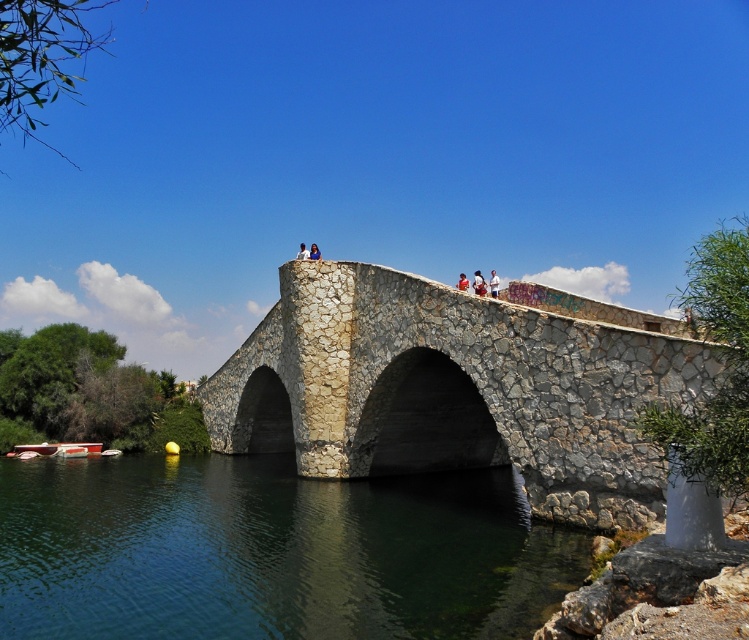
You are a photographer planning to capture the stone textured bridge at center and the light blue fabric at upper center in a single shot. Given their sizes, which object should you focus on to ensure both are clearly visible in the frame?

The stone textured bridge at center has a larger size compared to the light blue fabric at upper center, so focusing on the stone textured bridge at center will ensure both objects are clearly visible in the frame.

You are a photographer standing on the stone bridge. You want to capture both the white cotton shirt at center and the light blue fabric at upper center in a single photo. Considering your camera can only focus on objects within a 100 feet range, will you be able to include both subjects in the same frame?

The distance between the white cotton shirt at center and the light blue fabric at upper center is 118.49 feet, which exceeds the camera focus range of 100 feet. Therefore, you cannot capture both subjects in the same focused frame.